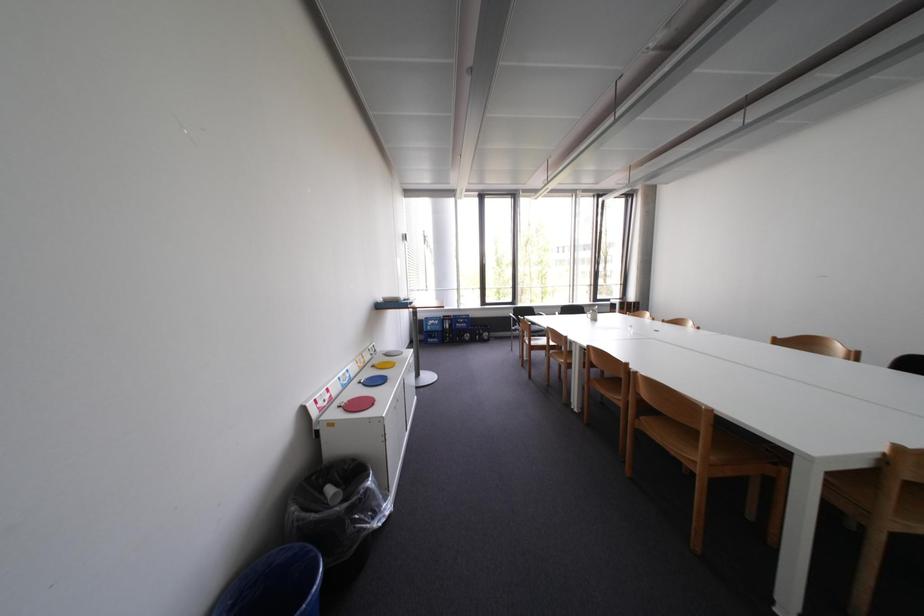
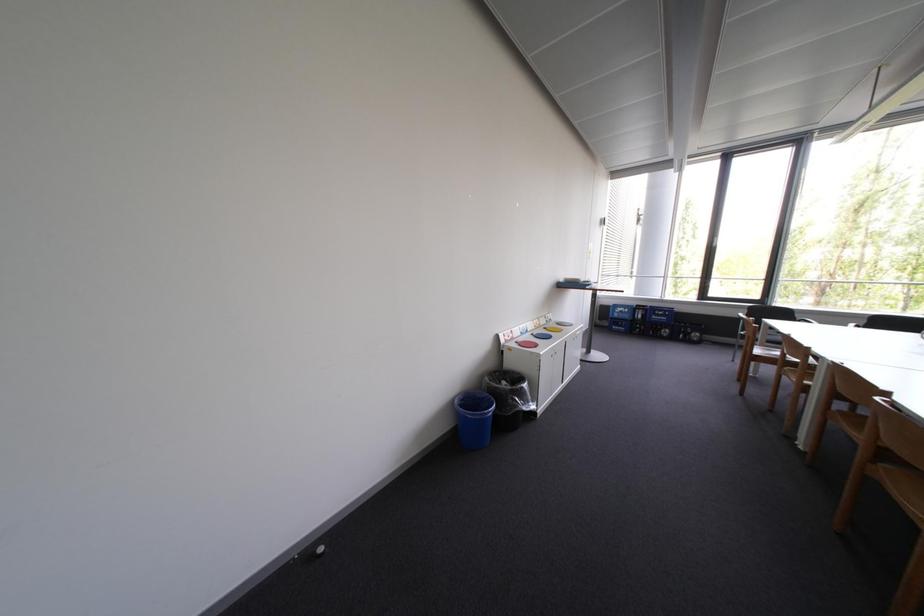
Question: The images are taken continuously from a first-person perspective. In which direction is your viewpoint rotating?

Choices:
 (A) Left
 (B) Right
 (C) Up
 (D) Down

Answer: (A)